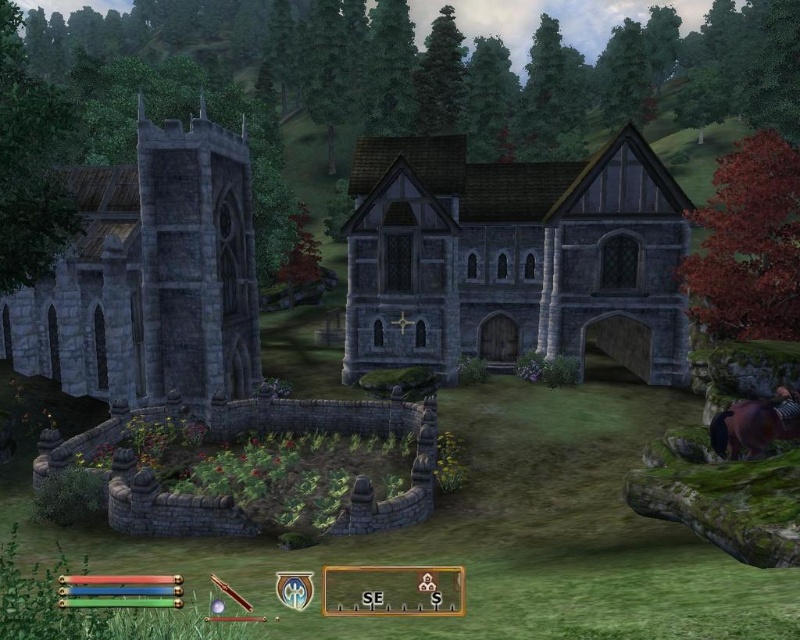
Question: Can you confirm if stone/timber medieval building at center is positioned to the right of gray stone tower at left?

Choices:
 (A) yes
 (B) no

Answer: (A)

Question: Is stone/timber medieval building at center further to camera compared to gray stone tower at left?

Choices:
 (A) no
 (B) yes

Answer: (B)

Question: Is stone/timber medieval building at center closer to the viewer compared to gray stone tower at left?

Choices:
 (A) no
 (B) yes

Answer: (A)

Question: Among these objects, which one is farthest from the camera?

Choices:
 (A) gray stone tower at left
 (B) stone/timber medieval building at center

Answer: (B)

Question: Which point is closer to the camera?

Choices:
 (A) (558, 308)
 (B) (84, 236)

Answer: (B)